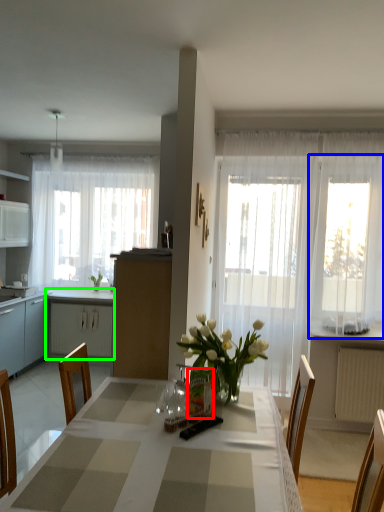
Question: Based on their relative distances, which object is farther from vase (highlighted by a red box)? Choose from window (highlighted by a blue box) and cabinetry (highlighted by a green box).

Choices:
 (A) window
 (B) cabinetry

Answer: (B)